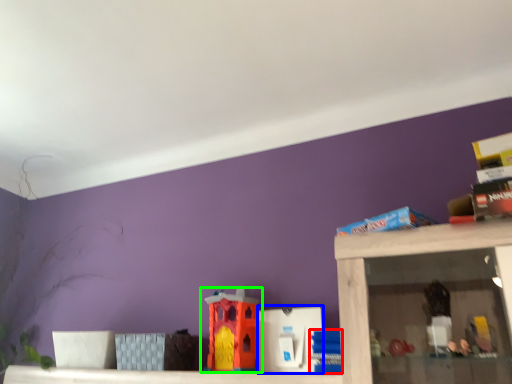
Question: Estimate the real-world distances between objects in this image. Which object is closer to toy (highlighted by a red box), toy (highlighted by a blue box) or toy (highlighted by a green box)?

Choices:
 (A) toy
 (B) toy

Answer: (A)